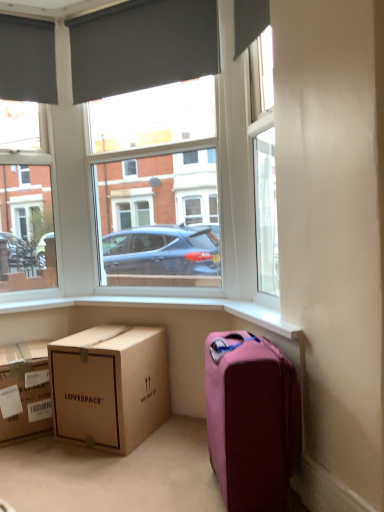
What is the approximate width of pink fabric suitcase at lower right?

pink fabric suitcase at lower right is 11.24 inches wide.

Looking at this image, measure the distance between brown cardboard box at lower left, the 1th box in the left-to-right sequence, and camera.

brown cardboard box at lower left, the 1th box in the left-to-right sequence, is 2.22 meters from camera.

I want to click on pink fabric suitcase at lower right, so click(251, 420).

From a real-world perspective, is brown cardboard box at lower left, the 1th box in the right-to-left sequence, located beneath matte black window at upper left?

Indeed, from a real-world perspective, brown cardboard box at lower left, the 1th box in the right-to-left sequence, is positioned beneath matte black window at upper left.

Considering the sizes of objects brown cardboard box at lower left, the 1th box in the right-to-left sequence, and matte black window at upper left in the image provided, who is thinner, brown cardboard box at lower left, the 1th box in the right-to-left sequence, or matte black window at upper left?

matte black window at upper left is thinner.

Is there a large distance between brown cardboard box at lower left, the 1th box in the right-to-left sequence, and matte black window at upper left?

Actually, brown cardboard box at lower left, the 1th box in the right-to-left sequence, and matte black window at upper left are a little close together.

Could you measure the distance between brown cardboard box at lower left, the 1th box in the right-to-left sequence, and matte black window at upper left?

brown cardboard box at lower left, the 1th box in the right-to-left sequence, and matte black window at upper left are 38.11 inches apart.

Is brown cardboard box at lower left, the 1th box in the left-to-right sequence, at the right side of white plastic window frame at upper center?

In fact, brown cardboard box at lower left, the 1th box in the left-to-right sequence, is to the left of white plastic window frame at upper center.

From a real-world perspective, does brown cardboard box at lower left, the 1th box in the left-to-right sequence, sit lower than white plastic window frame at upper center?

Correct, in the physical world, brown cardboard box at lower left, the 1th box in the left-to-right sequence, is lower than white plastic window frame at upper center.

From the image's perspective, is brown cardboard box at lower left, the 1th box in the left-to-right sequence, on top of white plastic window frame at upper center?

No, from the image's perspective, brown cardboard box at lower left, the 1th box in the left-to-right sequence, is not over white plastic window frame at upper center.

Between brown cardboard box at lower left, the 1th box in the left-to-right sequence, and white plastic window frame at upper center, which one has more height?

Standing taller between the two is white plastic window frame at upper center.

How distant is dark gray fabric at upper center, positioned as the first curtain in right-to-left order, from white smooth window sill at lower right?

A distance of 5.23 feet exists between dark gray fabric at upper center, positioned as the first curtain in right-to-left order, and white smooth window sill at lower right.

From the image's perspective, is dark gray fabric at upper center, positioned as the first curtain in right-to-left order, located beneath white smooth window sill at lower right?

Incorrect, from the image's perspective, dark gray fabric at upper center, positioned as the first curtain in right-to-left order, is higher than white smooth window sill at lower right.

Considering the positions of objects dark gray fabric at upper center, positioned as the first curtain in right-to-left order, and white smooth window sill at lower right in the image provided, who is more to the right, dark gray fabric at upper center, positioned as the first curtain in right-to-left order, or white smooth window sill at lower right?

Positioned to the right is white smooth window sill at lower right.

Based on the photo, is dark gray fabric at upper center, positioned as the first curtain in right-to-left order, next to white smooth window sill at lower right and touching it?

There is a gap between dark gray fabric at upper center, positioned as the first curtain in right-to-left order, and white smooth window sill at lower right.

From a real-world perspective, which object rests below the other?

From a 3D spatial view, pink fabric suitcase at lower right is below.

Is white plastic window frame at upper center with pink fabric suitcase at lower right?

No, white plastic window frame at upper center is not with pink fabric suitcase at lower right.

Is white plastic window frame at upper center taller or shorter than pink fabric suitcase at lower right?

In the image, white plastic window frame at upper center appears to be taller than pink fabric suitcase at lower right.

Between point (189, 214) and point (269, 463), which one is positioned in front?

The point (269, 463) is more forward.

Is pink fabric suitcase at lower right further to camera compared to brown cardboard box at lower left, the second box viewed from the right?

No, the depth of pink fabric suitcase at lower right is less than that of brown cardboard box at lower left, the second box viewed from the right.

From a real-world perspective, is pink fabric suitcase at lower right located higher than brown cardboard box at lower left, the 1th box in the left-to-right sequence?

Correct, in the physical world, pink fabric suitcase at lower right is higher than brown cardboard box at lower left, the 1th box in the left-to-right sequence.

Is pink fabric suitcase at lower right smaller than brown cardboard box at lower left, the 1th box in the left-to-right sequence?

Incorrect, pink fabric suitcase at lower right is not smaller in size than brown cardboard box at lower left, the 1th box in the left-to-right sequence.

Is point (141, 52) positioned behind point (69, 437)?

Yes.

In terms of size, does dark gray fabric at upper center, positioned as the first curtain in right-to-left order, appear bigger or smaller than brown cardboard box at lower left, the second box from the left?

Considering their sizes, dark gray fabric at upper center, positioned as the first curtain in right-to-left order, takes up less space than brown cardboard box at lower left, the second box from the left.

Considering the positions of objects dark gray fabric at upper center, positioned as the first curtain in right-to-left order, and brown cardboard box at lower left, the second box from the left, in the image provided, who is behind, dark gray fabric at upper center, positioned as the first curtain in right-to-left order, or brown cardboard box at lower left, the second box from the left,?

dark gray fabric at upper center, positioned as the first curtain in right-to-left order, is more distant.

From a real-world perspective, is brown cardboard box at lower left, the second box viewed from the right, physically located above or below white smooth window sill at lower right?

brown cardboard box at lower left, the second box viewed from the right, is below white smooth window sill at lower right.

In the scene shown: From the image's perspective, which is below, brown cardboard box at lower left, the 1th box in the left-to-right sequence, or white smooth window sill at lower right?

brown cardboard box at lower left, the 1th box in the left-to-right sequence, from the image's perspective.

I want to click on window sill on the right of brown cardboard box at lower left, the 1th box in the left-to-right sequence, so click(262, 318).

Is brown cardboard box at lower left, the second box viewed from the right, inside or outside of white smooth window sill at lower right?

The correct answer is: outside.

I want to click on the 2nd box in front when counting from the matte black window at upper left, so click(109, 386).

Identify the location of window frame behind the brown cardboard box at lower left, the 1th box in the left-to-right sequence. (157, 185).

From the image, which object appears to be nearer to pink fabric suitcase at lower right, dark gray matte curtain at upper left, placed as the 2th curtain when sorted from right to left, or white smooth window sill at lower right?

white smooth window sill at lower right lies closer to pink fabric suitcase at lower right than the other object.

Based on their spatial positions, is matte black window at upper left or dark gray matte curtain at upper left, which is counted as the 1th curtain, starting from the left, closer to white smooth window sill at lower right?

Among the two, matte black window at upper left is located nearer to white smooth window sill at lower right.

Estimate the real-world distances between objects in this image. Which object is closer to dark gray fabric at upper center, positioned as the first curtain in right-to-left order, matte black window at upper left or white plastic window frame at upper center?

matte black window at upper left is closer to dark gray fabric at upper center, positioned as the first curtain in right-to-left order.

Looking at the image, which one is located closer to brown cardboard box at lower left, the 1th box in the right-to-left sequence, white plastic window frame at upper center or dark gray fabric at upper center, positioned as the first curtain in right-to-left order?

dark gray fabric at upper center, positioned as the first curtain in right-to-left order.

Based on their spatial positions, is dark gray matte curtain at upper left, placed as the 2th curtain when sorted from right to left, or matte black window at upper left further from dark gray fabric at upper center, positioned as the first curtain in right-to-left order?

The object further to dark gray fabric at upper center, positioned as the first curtain in right-to-left order, is matte black window at upper left.

When comparing their distances from white smooth window sill at lower right, does brown cardboard box at lower left, the second box from the left, or brown cardboard box at lower left, the 1th box in the left-to-right sequence, seem closer?

Among the two, brown cardboard box at lower left, the second box from the left, is located nearer to white smooth window sill at lower right.

Estimate the real-world distances between objects in this image. Which object is closer to white plastic window frame at upper center, brown cardboard box at lower left, the second box from the left, or dark gray matte curtain at upper left, placed as the 2th curtain when sorted from right to left?

dark gray matte curtain at upper left, placed as the 2th curtain when sorted from right to left.

Considering their positions, is white plastic window frame at upper center positioned closer to dark gray fabric at upper center, which ranks as the second curtain in left-to-right order, than white smooth window sill at lower right?

The object closer to dark gray fabric at upper center, which ranks as the second curtain in left-to-right order, is white smooth window sill at lower right.

Image resolution: width=384 pixels, height=512 pixels. What are the coordinates of `window frame between dark gray fabric at upper center, which ranks as the second curtain in left-to-right order, and brown cardboard box at lower left, the second box viewed from the right, in the vertical direction` in the screenshot? It's located at (157, 185).

Where is `window frame between dark gray matte curtain at upper left, which is counted as the 1th curtain, starting from the left, and white smooth window sill at lower right in the up-down direction`? The height and width of the screenshot is (512, 384). window frame between dark gray matte curtain at upper left, which is counted as the 1th curtain, starting from the left, and white smooth window sill at lower right in the up-down direction is located at coordinates pyautogui.click(x=157, y=185).

Where is `window sill between dark gray matte curtain at upper left, placed as the 2th curtain when sorted from right to left, and brown cardboard box at lower left, the second box viewed from the right, in the up-down direction`? This screenshot has width=384, height=512. window sill between dark gray matte curtain at upper left, placed as the 2th curtain when sorted from right to left, and brown cardboard box at lower left, the second box viewed from the right, in the up-down direction is located at coordinates (262, 318).

At what (x,y) coordinates should I click in order to perform the action: click on window between dark gray fabric at upper center, which ranks as the second curtain in left-to-right order, and white smooth window sill at lower right vertically. Please return your answer as a coordinate pair (x, y). The height and width of the screenshot is (512, 384). Looking at the image, I should click on (28, 204).